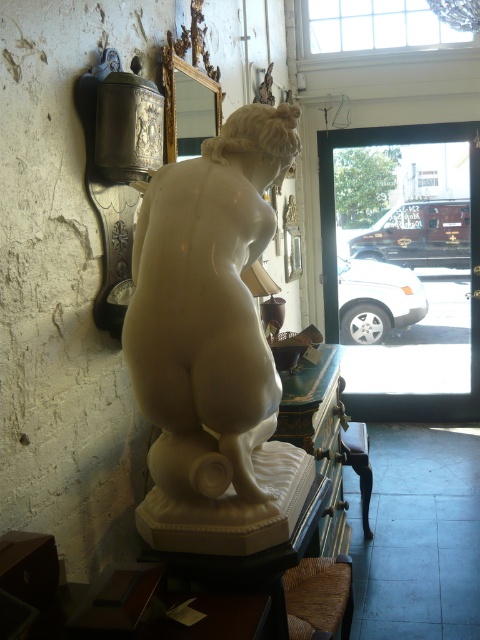
Question: Which object is closer to the camera taking this photo?

Choices:
 (A) brown woven stool at lower center
 (B) white marble statue at left

Answer: (B)

Question: Which object is closer to the camera taking this photo?

Choices:
 (A) wooden stool at lower center
 (B) brown woven stool at lower center
 (C) white marble statue at left

Answer: (C)

Question: Considering the relative positions of white marble statue at left and wooden stool at lower center in the image provided, where is white marble statue at left located with respect to wooden stool at lower center?

Choices:
 (A) right
 (B) left

Answer: (B)

Question: Which object appears farthest from the camera in this image?

Choices:
 (A) white marble statue at left
 (B) wooden stool at lower center

Answer: (B)

Question: Does white marble statue at left appear over wooden stool at lower center?

Choices:
 (A) yes
 (B) no

Answer: (A)

Question: Is white marble statue at left to the right of brown woven stool at lower center from the viewer's perspective?

Choices:
 (A) yes
 (B) no

Answer: (B)